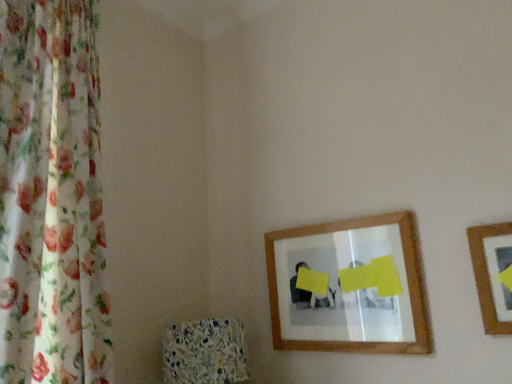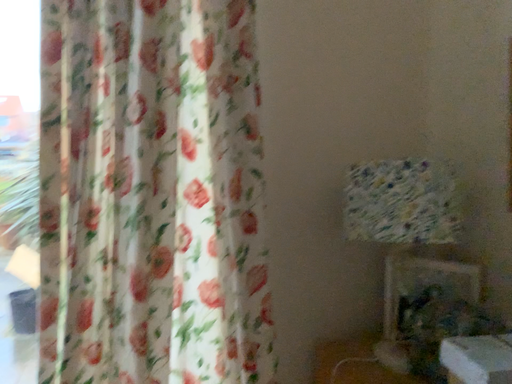
Question: Which way did the camera rotate in the video?

Choices:
 (A) rotated upward
 (B) rotated downward

Answer: (B)